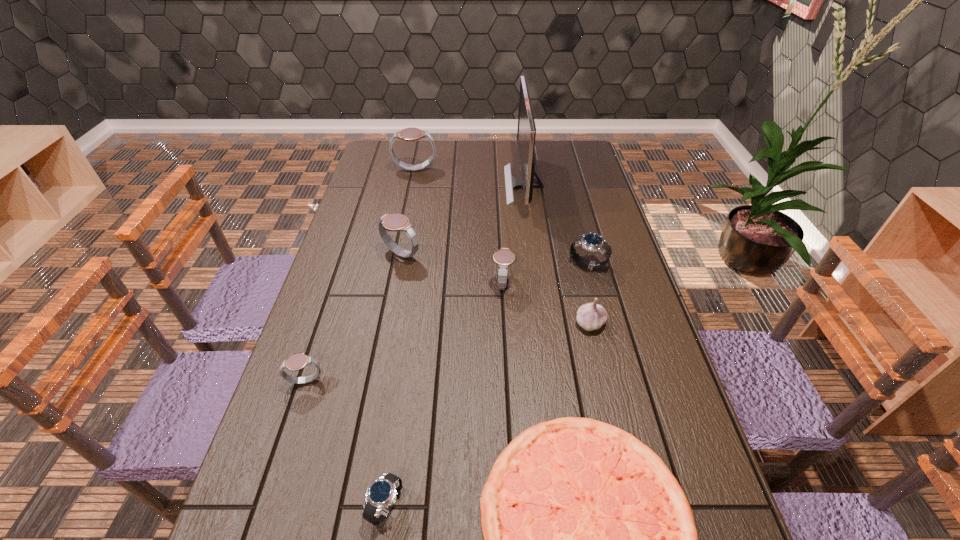
What are the coordinates of `the tallest object` in the screenshot? It's located at (526, 131).

Find the location of a particular element. the tallest watch is located at coordinates (408, 134).

Locate an element on the screen. This screenshot has width=960, height=540. the eighth shortest object is located at coordinates [408, 134].

Where is `the seventh shortest object`? The image size is (960, 540). the seventh shortest object is located at coordinates (392, 222).

Locate an element on the screen. the third smallest gray watch is located at coordinates (392, 222).

You are a GUI agent. You are given a task and a screenshot of the screen. Output one action in this format:
    pyautogui.click(x=<x>, y=<y>)
    Task: Click on the rightmost gray watch
    
    Given the screenshot: What is the action you would take?
    pyautogui.click(x=504, y=257)

The image size is (960, 540). Find the location of `the second nearest gray watch`. the second nearest gray watch is located at coordinates (504, 257).

At what (x,y) coordinates should I click in order to perform the action: click on the right silver watch. Please return your answer as a coordinate pair (x, y). Looking at the image, I should click on (594, 242).

The width and height of the screenshot is (960, 540). I want to click on the rightmost watch, so click(594, 242).

This screenshot has width=960, height=540. I want to click on garlic, so click(x=591, y=316).